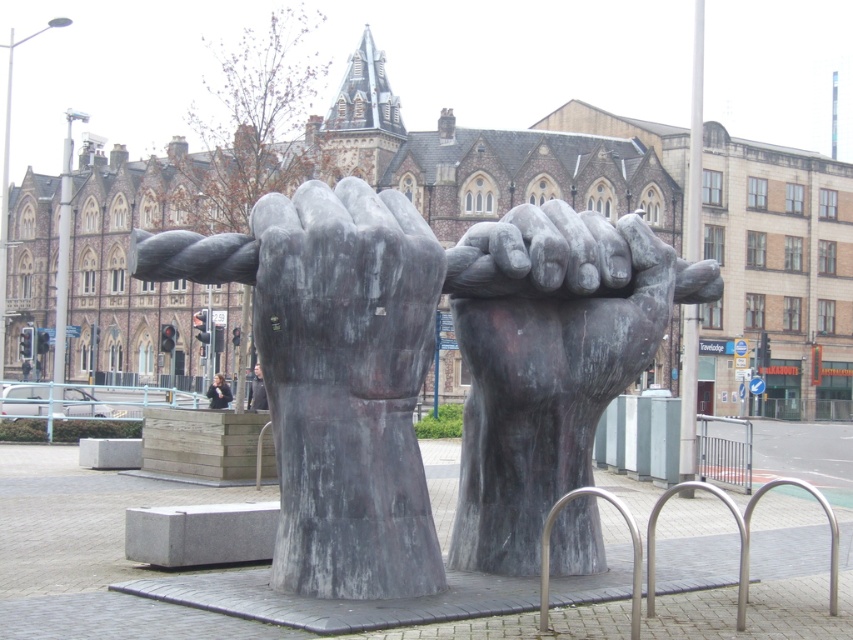
The width and height of the screenshot is (853, 640). What do you see at coordinates (425, 365) in the screenshot?
I see `matte gray stone fists at center` at bounding box center [425, 365].

The image size is (853, 640). I want to click on matte gray stone fists at center, so click(425, 365).

Where is `matte gray stone fists at center`? matte gray stone fists at center is located at coordinates (425, 365).

Can you confirm if matte gray stone fists at center is bigger than rustic stone fist at center?

Correct, matte gray stone fists at center is larger in size than rustic stone fist at center.

Does matte gray stone fists at center have a lesser height compared to rustic stone fist at center?

Incorrect, matte gray stone fists at center's height does not fall short of rustic stone fist at center's.

Is point (527, 262) in front of point (529, 460)?

That is True.

Where is `matte gray stone fists at center`? The width and height of the screenshot is (853, 640). matte gray stone fists at center is located at coordinates (425, 365).

Is light brown leather jacket at center closer to camera compared to dark gray fabric jacket at center?

No.

Is light brown leather jacket at center bigger than dark gray fabric jacket at center?

Yes, light brown leather jacket at center is bigger than dark gray fabric jacket at center.

Which is in front, point (213, 376) or point (258, 404)?

Point (258, 404) is in front.

Find the location of a particular element. light brown leather jacket at center is located at coordinates (218, 392).